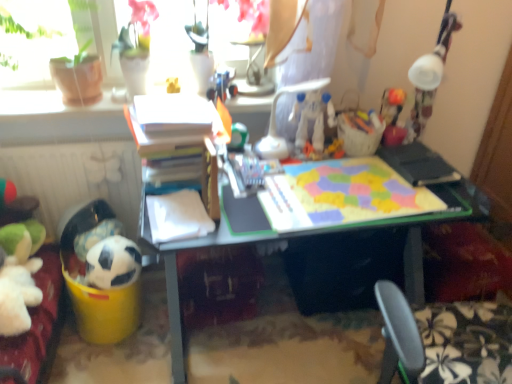
This screenshot has width=512, height=384. Find the location of `free point to the right of green matte ball at center, the third toy from the left`. free point to the right of green matte ball at center, the third toy from the left is located at coordinates (270, 153).